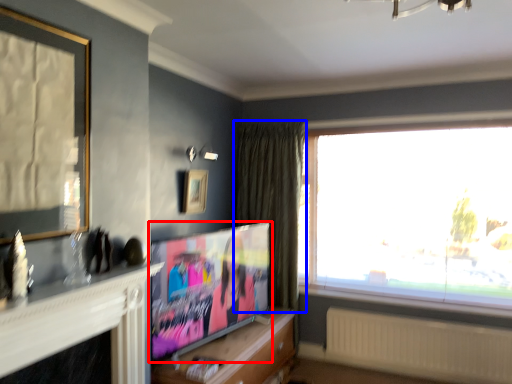
Question: Which object is closer to the camera taking this photo, television (highlighted by a red box) or curtain (highlighted by a blue box)?

Choices:
 (A) television
 (B) curtain

Answer: (A)